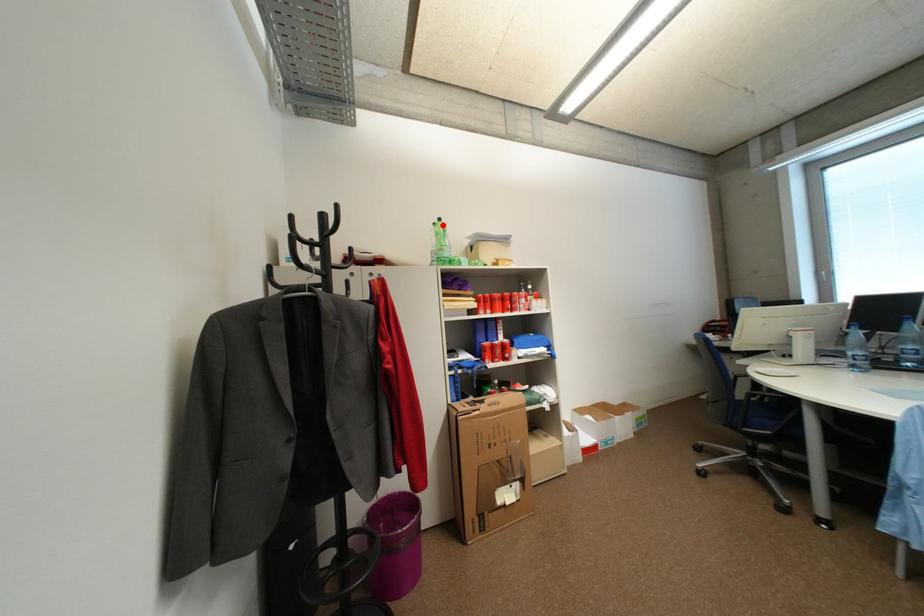
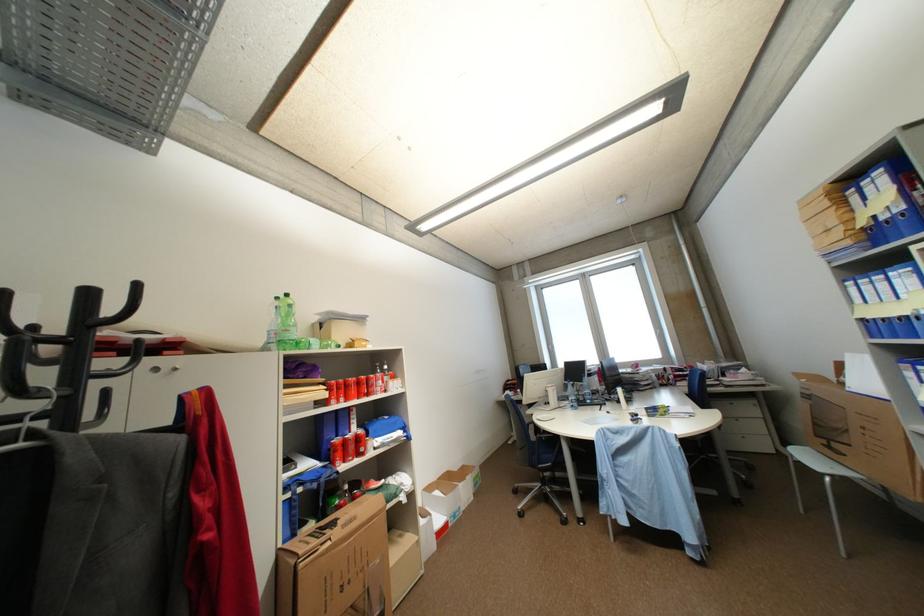
Locate, in the second image, the point that corresponds to the highlighted location in the first image.

(286, 300)